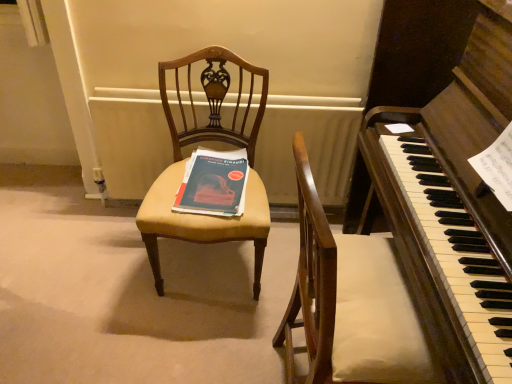
Question: Is point (244, 180) positioned closer to the camera than point (258, 216)?

Choices:
 (A) farther
 (B) closer

Answer: (A)

Question: Considering the positions of matte blue paper at center and matte yellow fabric chair at center in the image, is matte blue paper at center wider or thinner than matte yellow fabric chair at center?

Choices:
 (A) wide
 (B) thin

Answer: (B)

Question: Estimate the real-world distances between objects in this image. Which object is farther from the white painted radiator at center?

Choices:
 (A) matte blue paper at center
 (B) matte yellow fabric chair at center
 (C) dark brown polished wood harpsichord at center

Answer: (C)

Question: Considering the real-world distances, which object is farthest from the dark brown polished wood harpsichord at center?

Choices:
 (A) matte blue paper at center
 (B) white painted radiator at center
 (C) matte yellow fabric chair at center

Answer: (B)